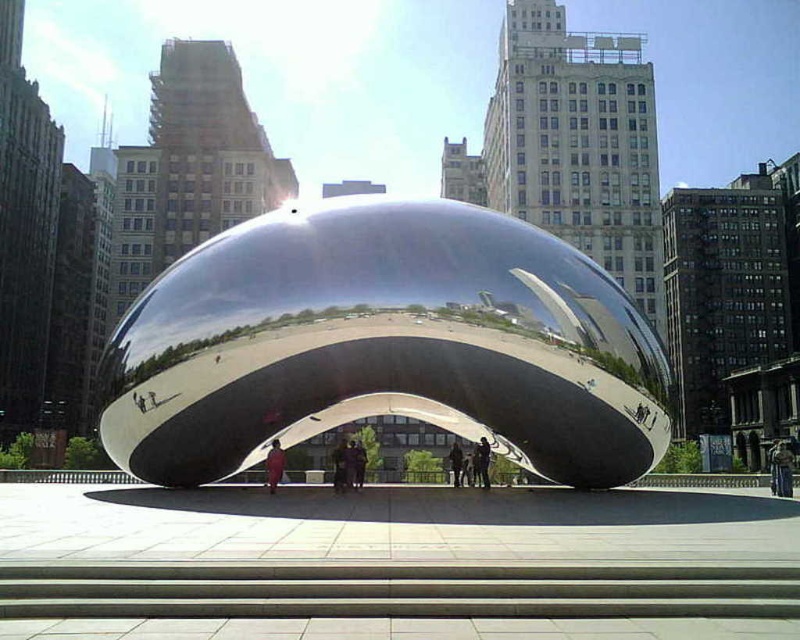
From the picture: Does red fabric coat at center appear on the right side of dark blue fabric at center?

Incorrect, red fabric coat at center is not on the right side of dark blue fabric at center.

Who is more forward, (x=278, y=465) or (x=488, y=465)?

Point (x=278, y=465) is more forward.

At what (x,y) coordinates should I click in order to perform the action: click on red fabric coat at center. Please return your answer as a coordinate pair (x, y). Looking at the image, I should click on (274, 465).

Is red fabric coat at center below dark gray fabric jacket at center?

Actually, red fabric coat at center is above dark gray fabric jacket at center.

This screenshot has height=640, width=800. Describe the element at coordinates (274, 465) in the screenshot. I see `red fabric coat at center` at that location.

Where is `red fabric coat at center`? red fabric coat at center is located at coordinates (274, 465).

Image resolution: width=800 pixels, height=640 pixels. I want to click on red fabric coat at center, so click(x=274, y=465).

Can you confirm if dark blue fabric at center is thinner than dark gray fabric jacket at center?

Indeed, dark blue fabric at center has a lesser width compared to dark gray fabric jacket at center.

Does dark blue fabric at center appear under dark gray fabric jacket at center?

Actually, dark blue fabric at center is above dark gray fabric jacket at center.

This screenshot has height=640, width=800. What are the coordinates of `dark blue fabric at center` in the screenshot? It's located at (482, 461).

This screenshot has width=800, height=640. Find the location of `dark blue fabric at center`. dark blue fabric at center is located at coordinates (482, 461).